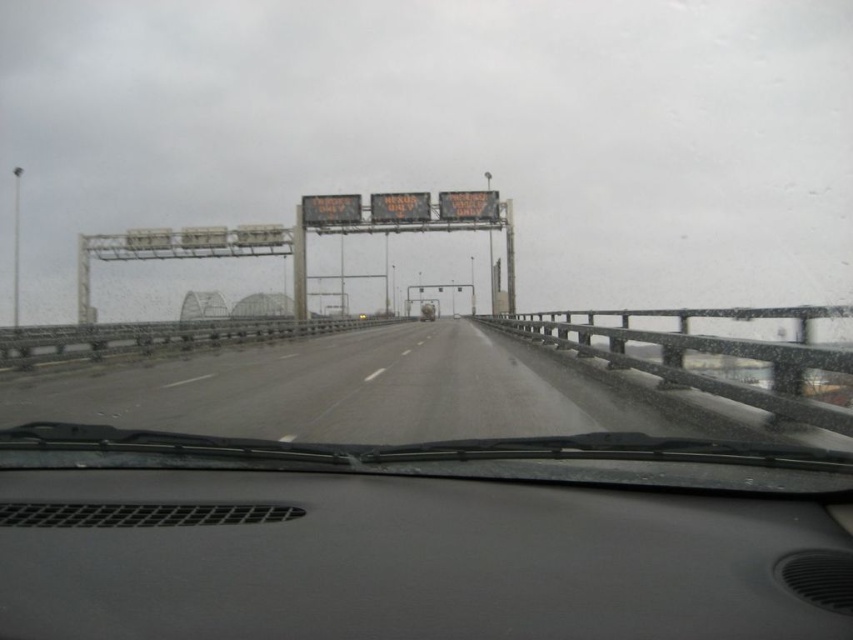
You are driving in a car and looking at the gray matte dashboard at center and the smooth asphalt highway at center. Which object is taller?

The gray matte dashboard at center is not as tall as the smooth asphalt highway at center, so the smooth asphalt highway at center is taller.

You are driving a car and looking through the windshield. You see the gray matte dashboard at center and the smooth asphalt highway at center. Which object is closer to your left side?

The smooth asphalt highway at center is closer to your left side because the gray matte dashboard at center is positioned to its right.